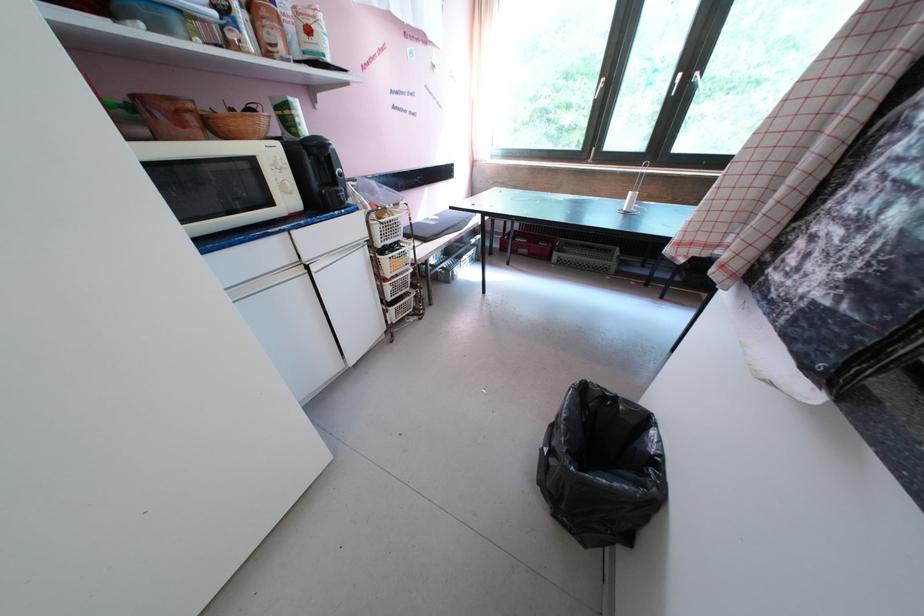
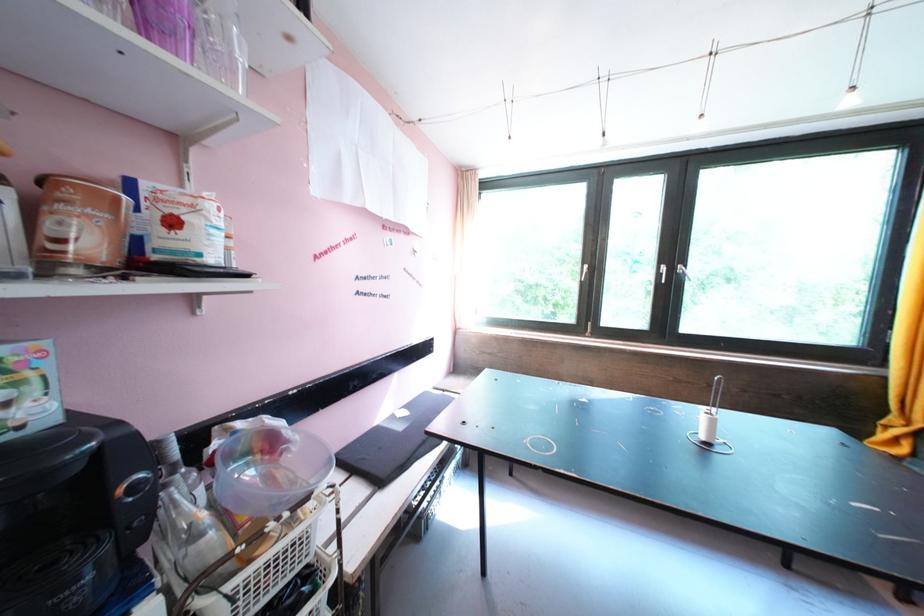
Question: The images are taken continuously from a first-person perspective. In which direction is your viewpoint rotating?

Choices:
 (A) Left
 (B) Right
 (C) Up
 (D) Down

Answer: (C)